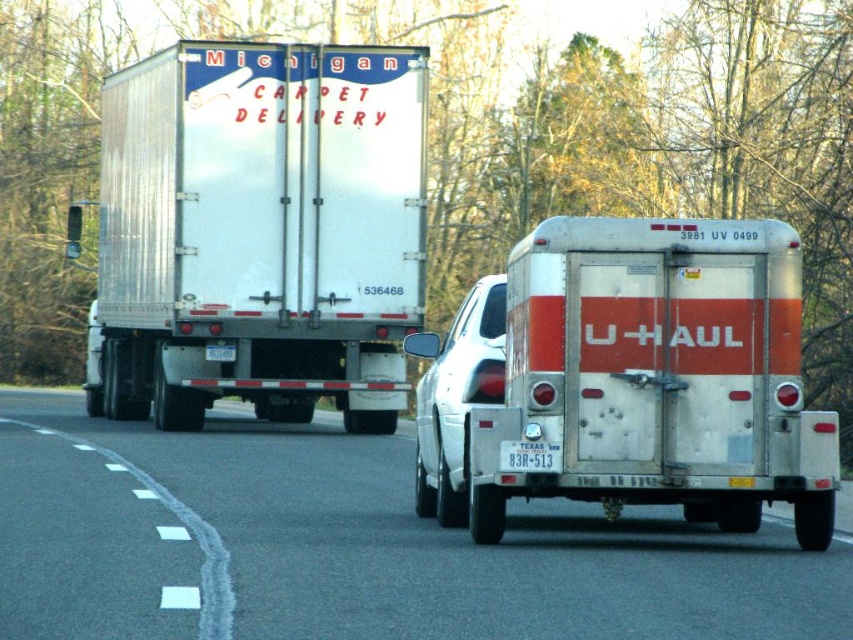
Question: Which of the following is the farthest from the observer?

Choices:
 (A) white plastic license plate at rear
 (B) silver metallic trailer at center
 (C) silver metallic trailer truck at center

Answer: (C)

Question: Is metallic silver trailer at center to the left of silver metallic trailer truck at center from the viewer's perspective?

Choices:
 (A) yes
 (B) no

Answer: (A)

Question: Which point is closer to the camera?

Choices:
 (A) (582, 225)
 (B) (451, 490)

Answer: (A)

Question: Is white glossy car at center positioned behind white plastic license plate at rear?

Choices:
 (A) no
 (B) yes

Answer: (A)

Question: Among these points, which one is farthest from the camera?

Choices:
 (A) (465, 326)
 (B) (683, 276)
 (C) (195, 593)
 (D) (549, 452)

Answer: (A)

Question: In this image, where is silver metallic trailer truck at center located relative to silver metallic trailer at center?

Choices:
 (A) right
 (B) left

Answer: (B)